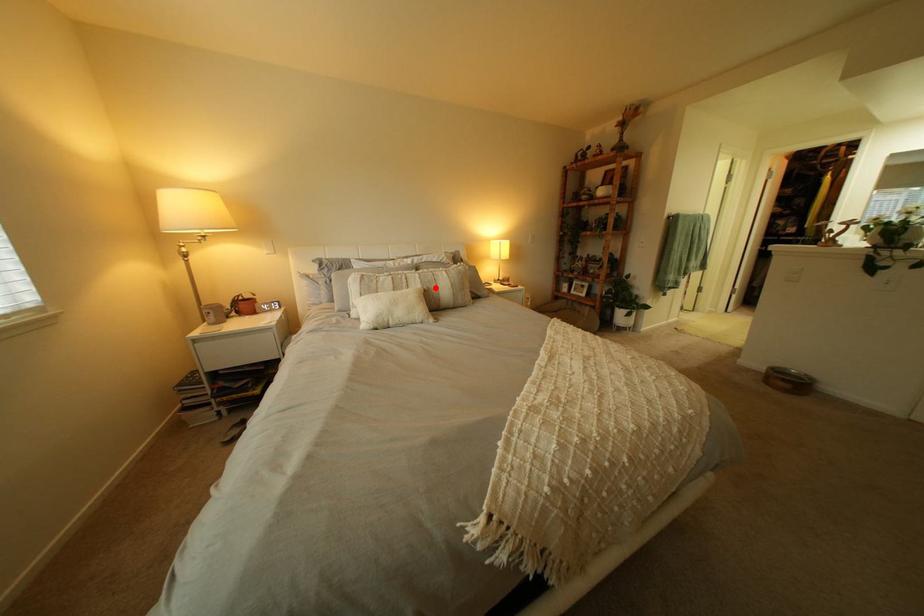
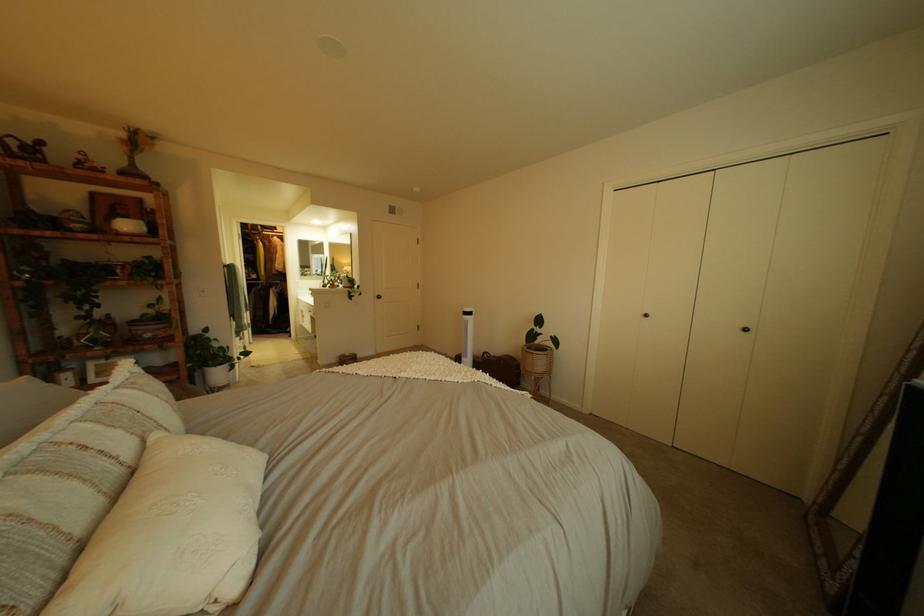
Find the pixel in the second image that matches the highlighted location in the first image.

(172, 436)